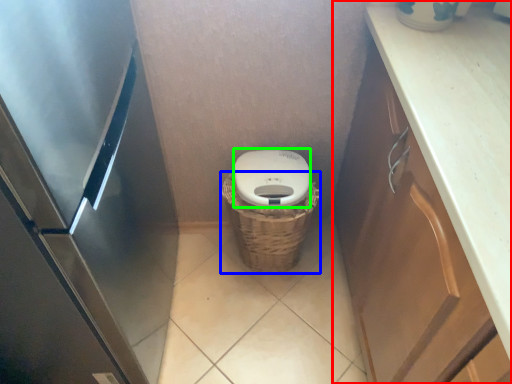
Question: Considering the real-world distances, which object is closest to cabinetry (highlighted by a red box)? basket (highlighted by a blue box) or lid (highlighted by a green box).

Choices:
 (A) basket
 (B) lid

Answer: (B)